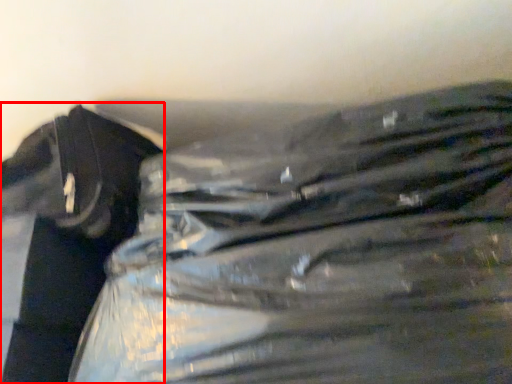
Question: Observing the image, what is the correct spatial positioning of waste (annotated by the red box) in reference to plastic bag?

Choices:
 (A) right
 (B) left

Answer: (B)